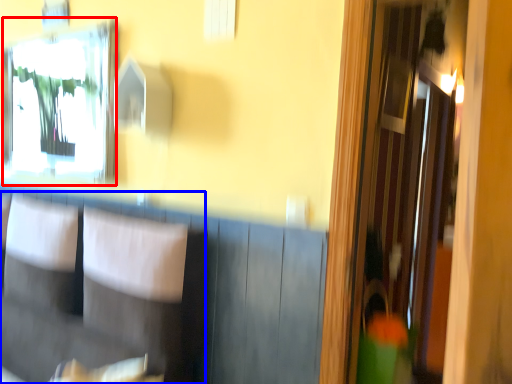
Question: Which object is closer to the camera taking this photo, mirror (highlighted by a red box) or armchair (highlighted by a blue box)?

Choices:
 (A) mirror
 (B) armchair

Answer: (B)